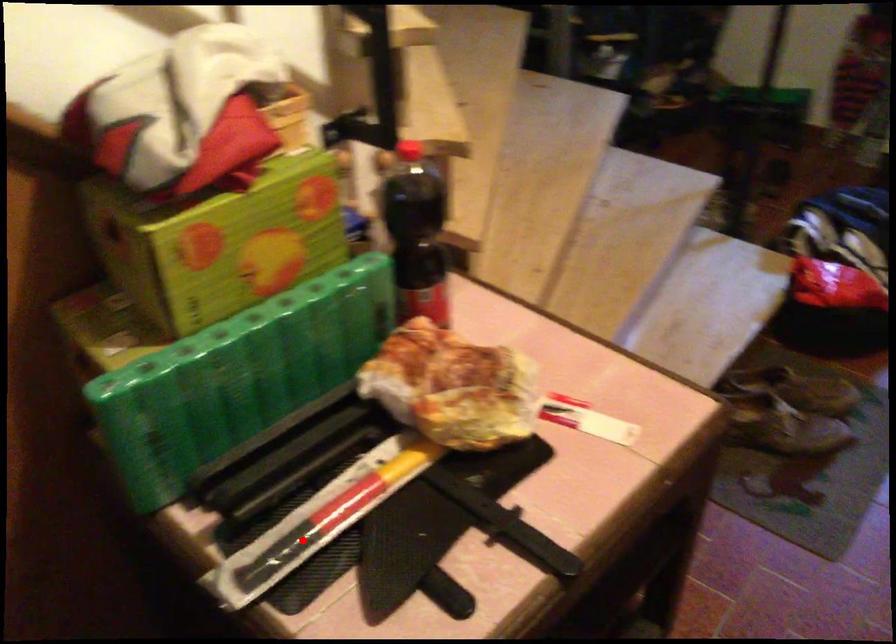
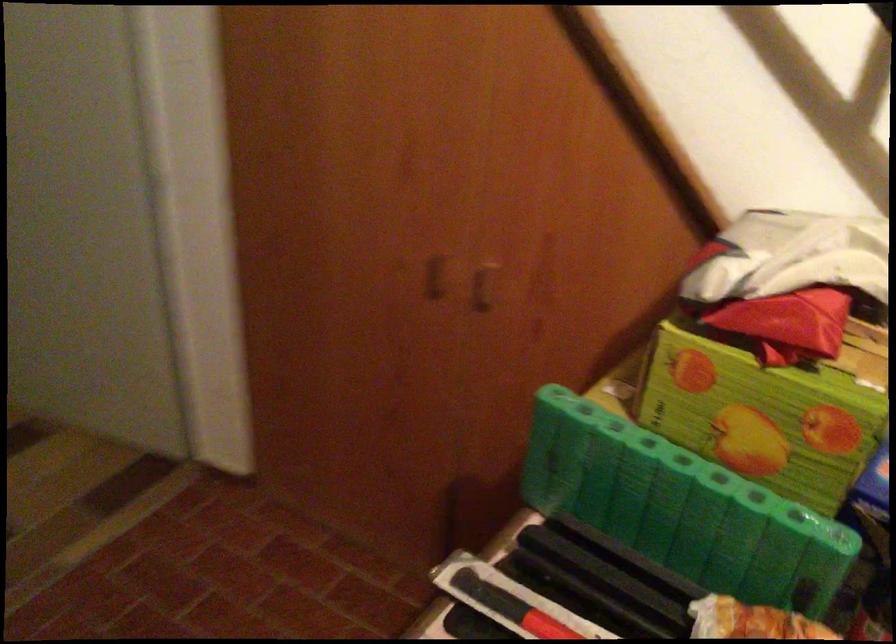
In the second image, find the point that corresponds to the highlighted location in the first image.

(510, 605)